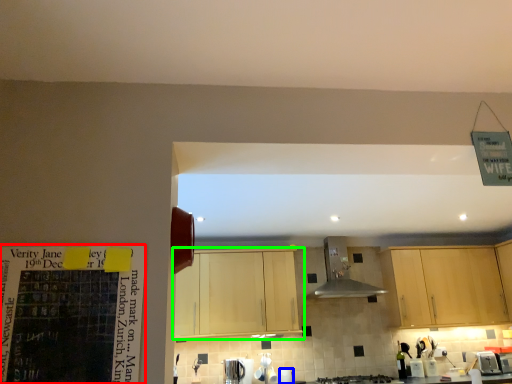
Question: Which is nearer to the bulletin board (highlighted by a red box)? appliance (highlighted by a blue box) or cabinetry (highlighted by a green box).

Choices:
 (A) appliance
 (B) cabinetry

Answer: (B)